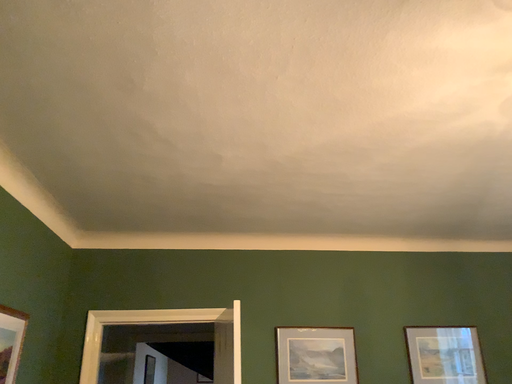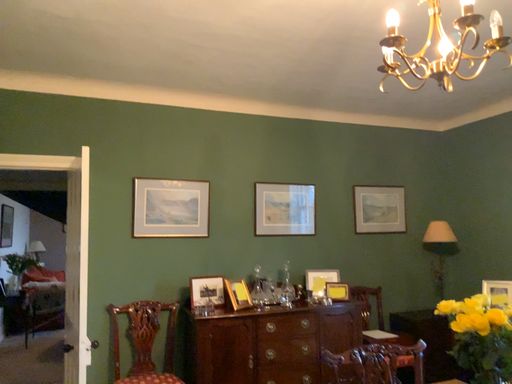
Question: How did the camera likely rotate when shooting the video?

Choices:
 (A) rotated upward
 (B) rotated downward

Answer: (B)